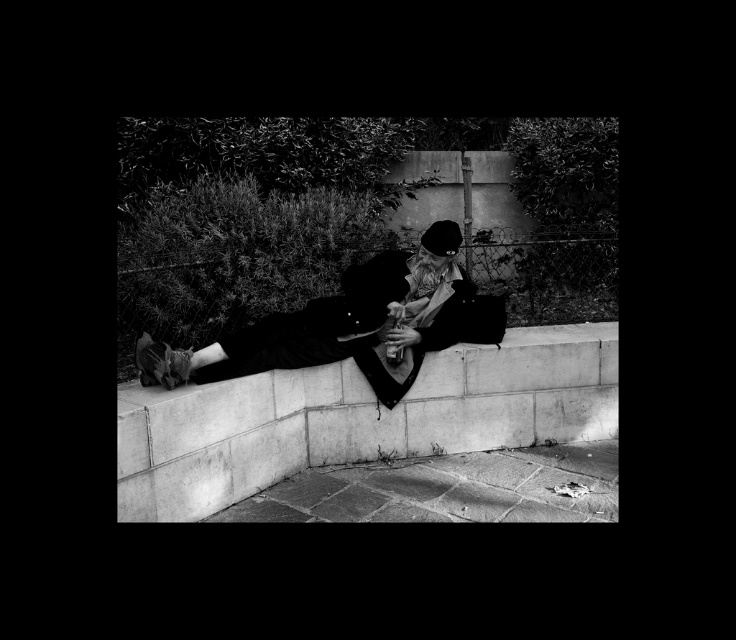
You are trying to place a small potted plant on the concrete at lower center so that it is visible from the viewpoint of someone standing in front of the black leather jacket at center. Based on the height difference between the two objects, will the potted plant be obscured by the jacket?

The concrete at lower center has a lesser height compared to black leather jacket at center, so the potted plant placed on the concrete at lower center would be partially or fully obscured by the black leather jacket at center since it is shorter than the jacket.

You are a photographer trying to capture a candid shot of the scene. To avoid casting a shadow on the black leather jacket at center, where should you position yourself relative to the concrete at lower center?

The concrete at lower center is positioned under the black leather jacket at center, so to avoid casting a shadow on the jacket, you should position yourself on the opposite side of the light source relative to the concrete at lower center.